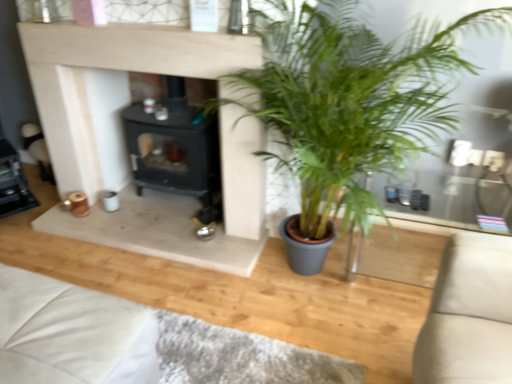
Question: From their relative heights in the image, would you say black matte fireplace at center is taller or shorter than green leafy plant at center?

Choices:
 (A) short
 (B) tall

Answer: (A)

Question: Would you say black matte fireplace at center is inside or outside green leafy plant at center?

Choices:
 (A) inside
 (B) outside

Answer: (B)

Question: Which object is positioned farthest from the green leafy plant at center?

Choices:
 (A) white leather couch at lower left
 (B) black matte fireplace at center

Answer: (A)

Question: Estimate the real-world distances between objects in this image. Which object is closer to the black matte fireplace at center?

Choices:
 (A) white leather couch at lower left
 (B) green leafy plant at center

Answer: (B)